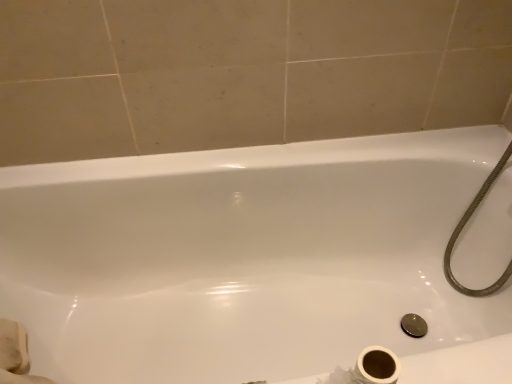
Question: Should I look upward or downward to see white glossy bathtub at center?

Choices:
 (A) up
 (B) down

Answer: (B)